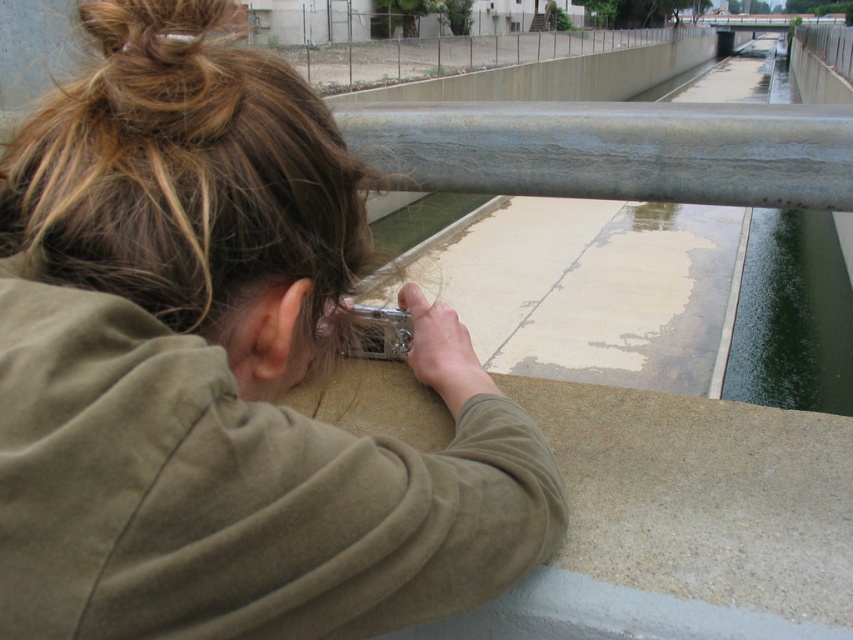
You are a photographer trying to capture a reflection in the water. The matte silver camera at upper left and the green smooth water at upper right are both in your view. Which object is positioned lower in the image?

The matte silver camera at upper left is located below the green smooth water at upper right, so it is positioned lower in the image.

You are a photographer trying to capture a shot through the rectangular opening in the concrete railing. You have a matte silver camera at upper left and brownhair at left. Which object is smaller in size?

The matte silver camera at upper left is smaller than brownhair at left according to the description.

You are a photographer trying to capture a clear shot of the green smooth water at upper right. The matte silver camera at upper left is in your hand. Is the camera positioned in a way that allows you to focus on the water without obstruction?

The matte silver camera at upper left is closer to the viewer than the green smooth water at upper right, so the camera is positioned between you and the water. This means the camera itself might block your view of the water, making it difficult to focus without adjusting your position or the camera angle.